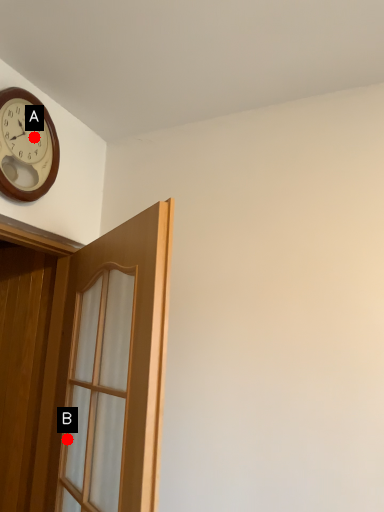
Question: Two points are circled on the image, labeled by A and B beside each circle. Which point appears closest to the camera in this image?

Choices:
 (A) A is closer
 (B) B is closer

Answer: (A)